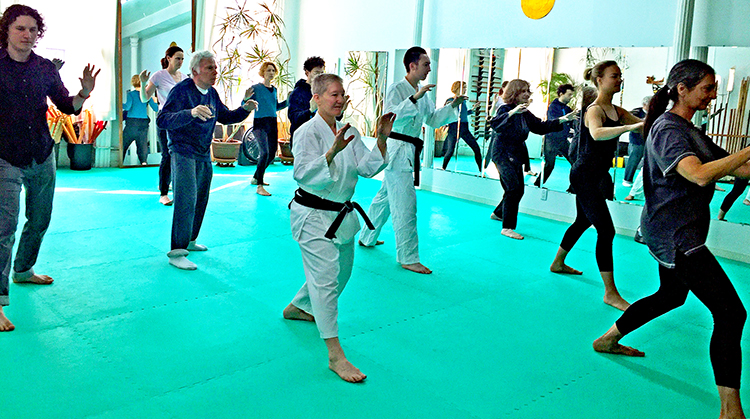
This screenshot has height=419, width=750. What are the coordinates of `pots` in the screenshot? It's located at (88, 155), (226, 151), (286, 150).